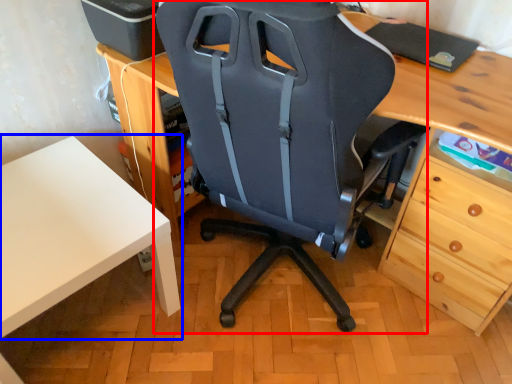
Question: Among these objects, which one is nearest to the camera, chair (highlighted by a red box) or table (highlighted by a blue box)?

Choices:
 (A) chair
 (B) table

Answer: (A)